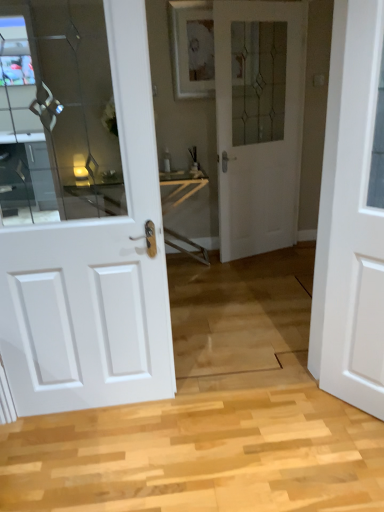
Image resolution: width=384 pixels, height=512 pixels. Find the location of `free location in front of white matte door at right, marked as the 3th door in a left-to-right arrangement`. free location in front of white matte door at right, marked as the 3th door in a left-to-right arrangement is located at coordinates (350, 443).